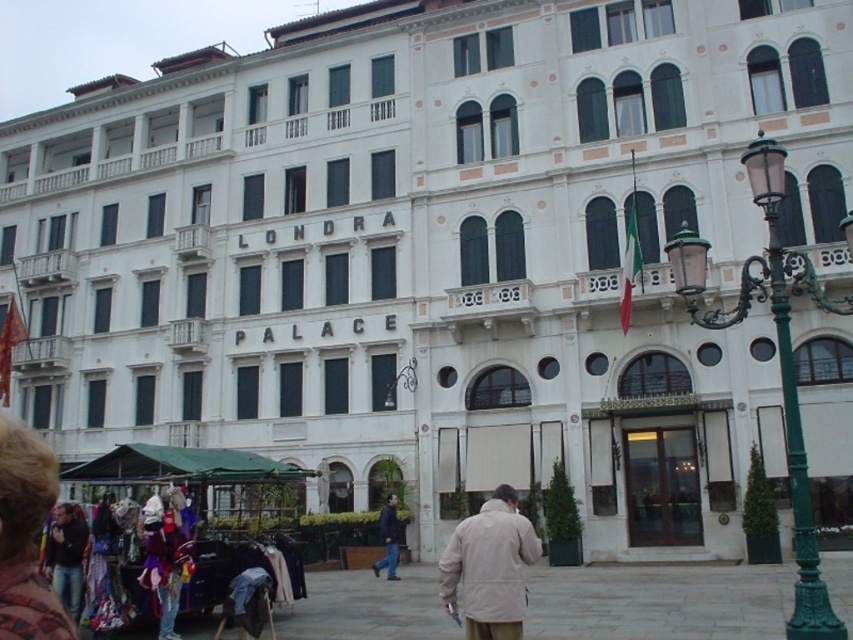
Identify the location of green wrought iron lamp post at center right. (778, 356).

The image size is (853, 640). Describe the element at coordinates (778, 356) in the screenshot. I see `green wrought iron lamp post at center right` at that location.

You are a GUI agent. You are given a task and a screenshot of the screen. Output one action in this format:
    pyautogui.click(x=<x>, y=<y>)
    Task: Click on the green wrought iron lamp post at center right
    This screenshot has width=853, height=640.
    Given the screenshot: What is the action you would take?
    pyautogui.click(x=778, y=356)

Does beige fabric coat at center appear under dark blue jacket at center?

Actually, beige fabric coat at center is above dark blue jacket at center.

Who is higher up, beige fabric coat at center or dark blue jacket at center?

beige fabric coat at center is higher up.

Measure the distance between beige fabric coat at center and camera.

73.04 feet

This screenshot has height=640, width=853. I want to click on beige fabric coat at center, so click(489, 566).

Which is in front, point (814, 294) or point (61, 547)?

Point (814, 294) is more forward.

The image size is (853, 640). Describe the element at coordinates (778, 356) in the screenshot. I see `green wrought iron lamp post at center right` at that location.

Where is `green wrought iron lamp post at center right`? This screenshot has width=853, height=640. green wrought iron lamp post at center right is located at coordinates (778, 356).